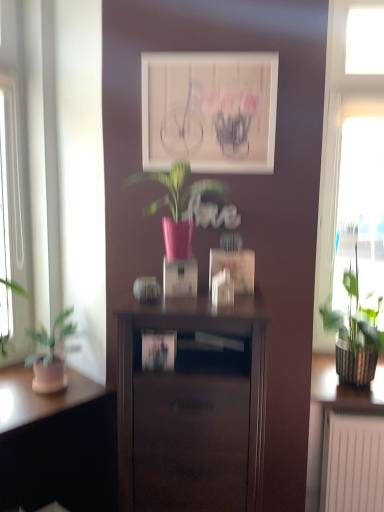
Question: Does dark wood nightstand at center come in front of green textured plant at right, the first houseplant positioned from the bottom?

Choices:
 (A) no
 (B) yes

Answer: (B)

Question: Is dark wood nightstand at center behind green textured plant at right, which is counted as the 2th houseplant, starting from the left?

Choices:
 (A) no
 (B) yes

Answer: (A)

Question: Does dark wood nightstand at center have a lesser height compared to green textured plant at right, which is counted as the 2th houseplant, starting from the left?

Choices:
 (A) yes
 (B) no

Answer: (B)

Question: Is green textured plant at right, the 1th houseplant viewed from the right, completely or partially inside dark wood nightstand at center?

Choices:
 (A) no
 (B) yes

Answer: (A)

Question: Is dark wood nightstand at center at the right side of green textured plant at right, which is counted as the 2th houseplant, starting from the front?

Choices:
 (A) no
 (B) yes

Answer: (A)

Question: From the image's perspective, does dark wood nightstand at center appear lower than green textured plant at right, which is counted as the 2th houseplant, starting from the left?

Choices:
 (A) no
 (B) yes

Answer: (B)

Question: Is transparent glass window at right facing towards matte white picture frame at center?

Choices:
 (A) yes
 (B) no

Answer: (B)

Question: From the image's perspective, does transparent glass window at right appear lower than matte white picture frame at center?

Choices:
 (A) yes
 (B) no

Answer: (A)

Question: Are transparent glass window at right and matte white picture frame at center located far from each other?

Choices:
 (A) no
 (B) yes

Answer: (A)

Question: Could matte white picture frame at center be considered to be inside transparent glass window at right?

Choices:
 (A) yes
 (B) no

Answer: (B)

Question: Does transparent glass window at right lie in front of matte white picture frame at center?

Choices:
 (A) yes
 (B) no

Answer: (B)

Question: Is transparent glass window at right at the left side of matte white picture frame at center?

Choices:
 (A) yes
 (B) no

Answer: (B)

Question: Is green textured plant at right, the 1th houseplant viewed from the right, positioned in front of matte white picture frame at center?

Choices:
 (A) no
 (B) yes

Answer: (A)